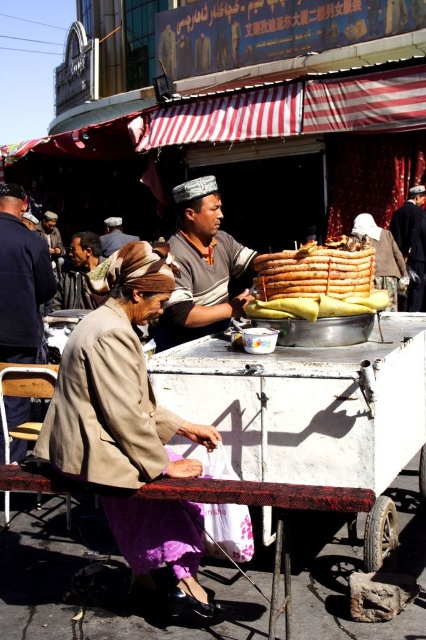
You are a customer observing the scene and want to buy a hat. You notice the brown leather jacket at lower left and the brown leather hat at upper left. Which item is smaller in size?

The brown leather jacket at lower left is smaller in size compared to the brown leather hat at upper left.

You are a customer at the market and see the brown leather jacket at lower left and the brown leather hat at upper left. Which item is closer to the right side of the scene?

The brown leather jacket at lower left is positioned on the right side of the brown leather hat at upper left, so the jacket is closer to the right side of the scene.